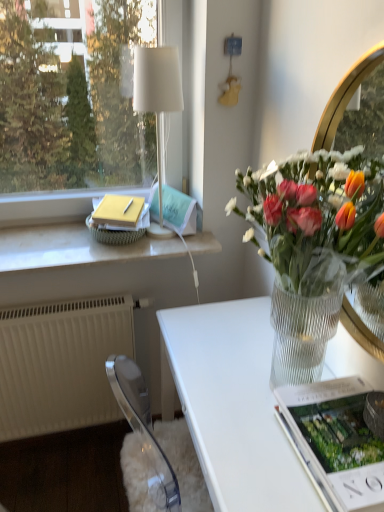
Locate an element on the screen. Image resolution: width=384 pixels, height=512 pixels. free space above matte white magazine at lower right, which is the second magazine in left-to-right order (from a real-world perspective) is located at coordinates (345, 420).